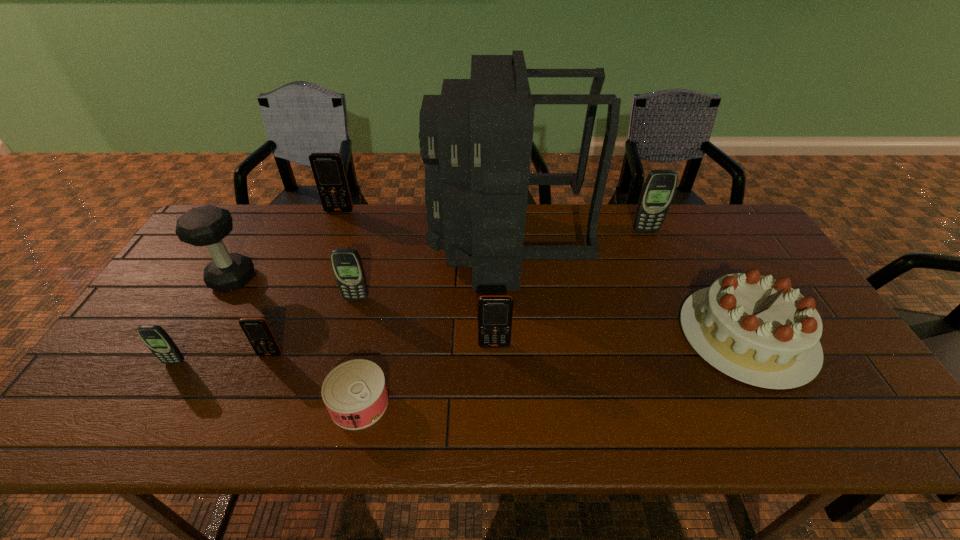
Identify the location of vacant area that lies between the farthest orange cellular telephone and the second smallest orange cellular telephone. (x=417, y=278).

The image size is (960, 540). Find the location of `free space between the gray backpack and the leftmost cellular telephone`. free space between the gray backpack and the leftmost cellular telephone is located at coordinates (340, 305).

This screenshot has width=960, height=540. Identify the location of vacant space in between the second biggest orange cellular telephone and the birthday cake. (621, 340).

You are a GUI agent. You are given a task and a screenshot of the screen. Output one action in this format:
    pyautogui.click(x=<x>, y=<y>)
    Task: Click on the free point between the farthest gray cellular telephone and the birthday cake
    
    Given the screenshot: What is the action you would take?
    pyautogui.click(x=696, y=283)

What are the coordinates of `blank region between the rightmost cellular telephone and the leftmost gray cellular telephone` in the screenshot? It's located at (410, 296).

Locate an element on the screen. free area in between the tallest object and the can is located at coordinates (433, 325).

You are a GUI agent. You are given a task and a screenshot of the screen. Output one action in this format:
    pyautogui.click(x=<x>, y=<y>)
    Task: Click on the object that is the sixth nearest to the birthday cake
    The image size is (960, 540).
    Given the screenshot: What is the action you would take?
    pyautogui.click(x=257, y=330)

At what (x,y) coordinates should I click in order to perform the action: click on the closest object to the shortest object. Please return your answer as a coordinate pair (x, y). Looking at the image, I should click on (257, 330).

Locate an element on the screen. cellular telephone that is the third closest to the farthest orange cellular telephone is located at coordinates (155, 337).

Point out which cellular telephone is positioned as the third nearest to the dumbbell. Please provide its 2D coordinates. Your answer should be formatted as a tuple, i.e. [(x, y)], where the tuple contains the x and y coordinates of a point satisfying the conditions above.

[(347, 265)]